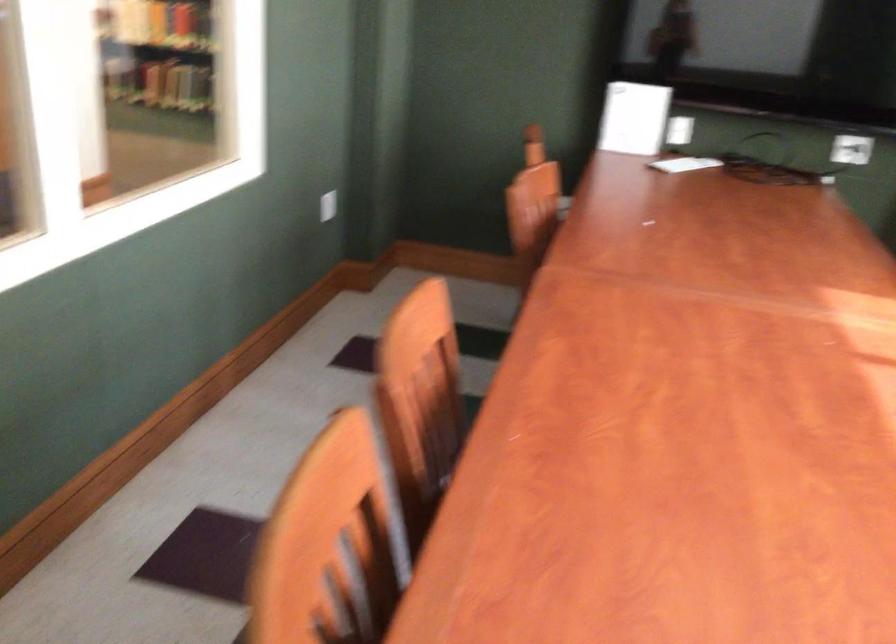
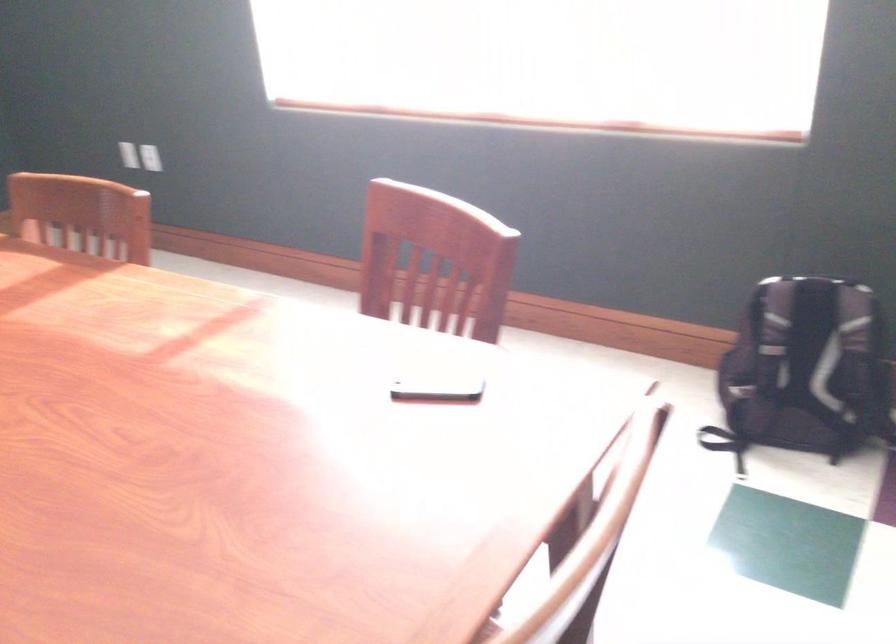
How did the camera likely rotate?

The rotation direction of the camera is right-down.